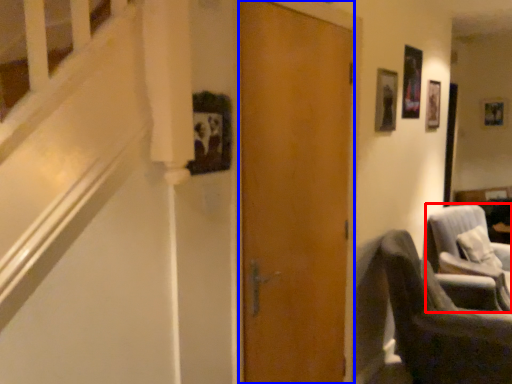
Question: Which of the following is the closest to the observer, chair (highlighted by a red box) or door (highlighted by a blue box)?

Choices:
 (A) chair
 (B) door

Answer: (B)